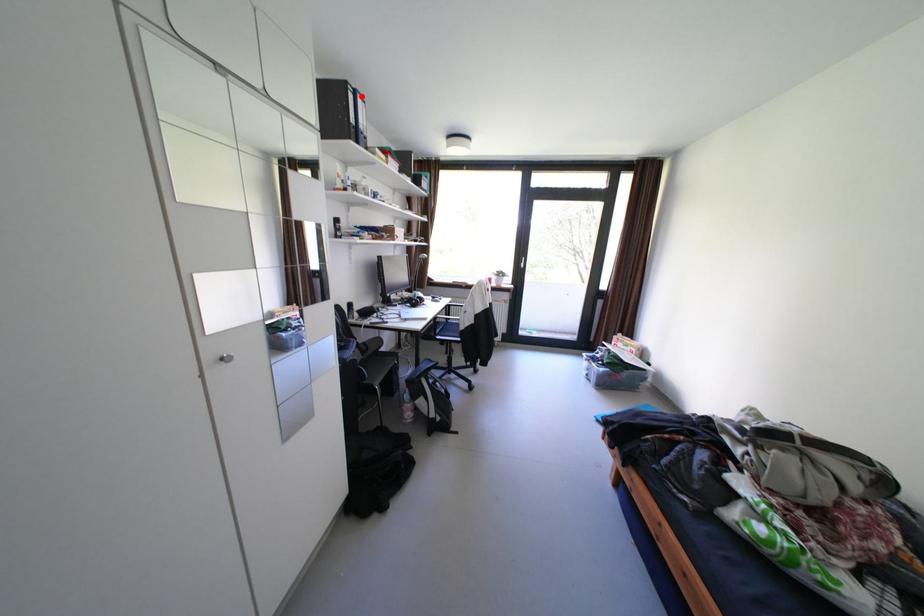
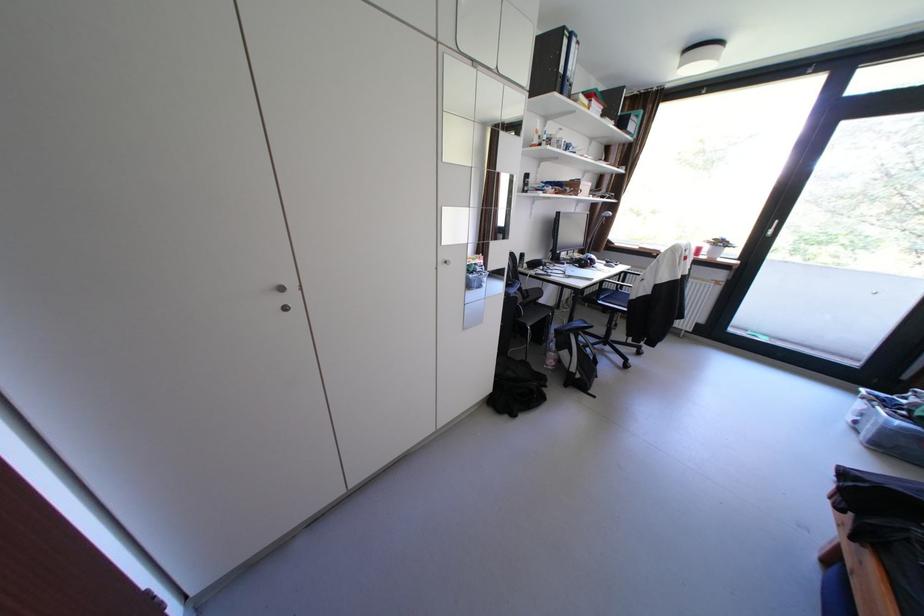
The point at the highlighted location is marked in the first image. Where is the corresponding point in the second image?

(576, 42)